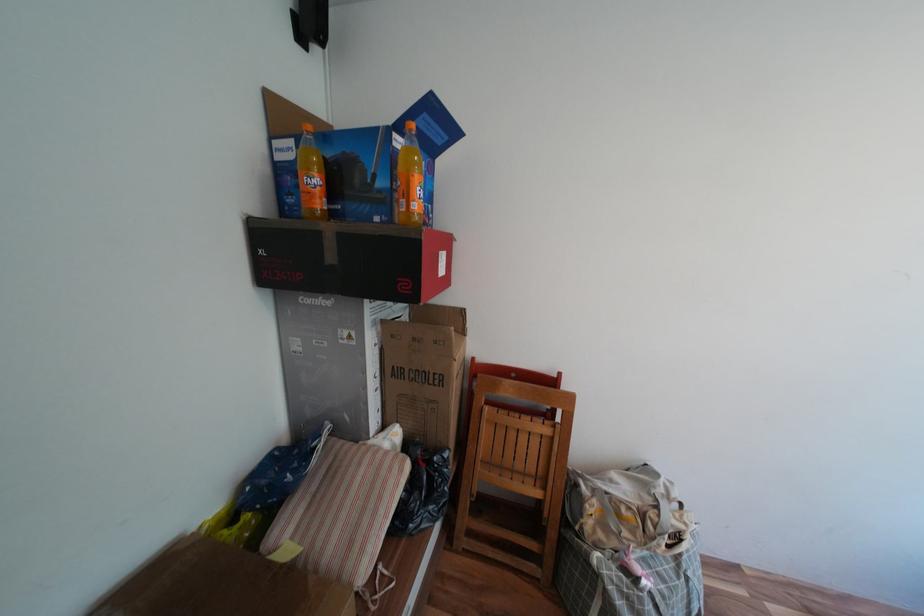
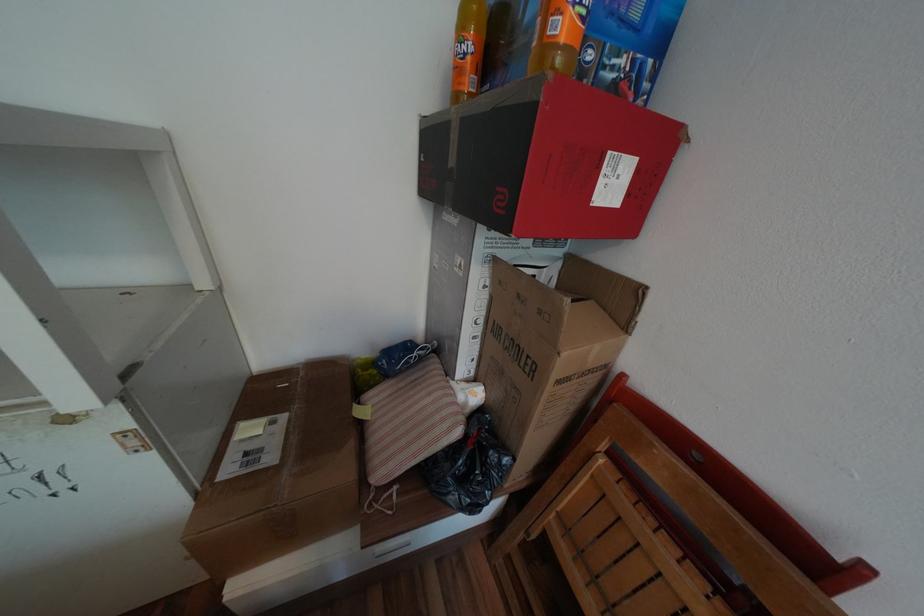
In the second image, find the point that corresponds to the point at 399,469 in the first image.

(453, 419)